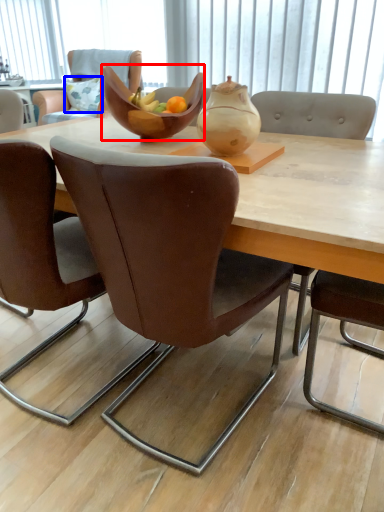
Question: Which of the following is the farthest to the observer, bowl (highlighted by a red box) or pillow (highlighted by a blue box)?

Choices:
 (A) bowl
 (B) pillow

Answer: (B)